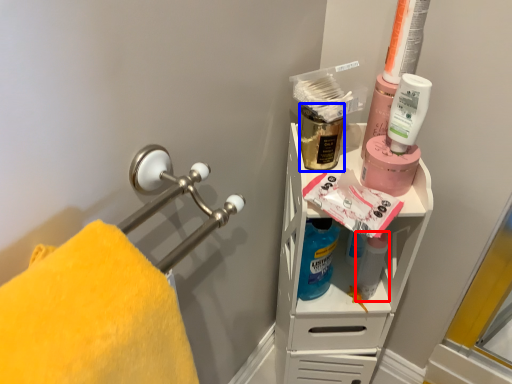
Question: Which point is closer to the camera, cleaning product (highlighted by a red box) or mouthwash (highlighted by a blue box)?

Choices:
 (A) cleaning product
 (B) mouthwash

Answer: (B)